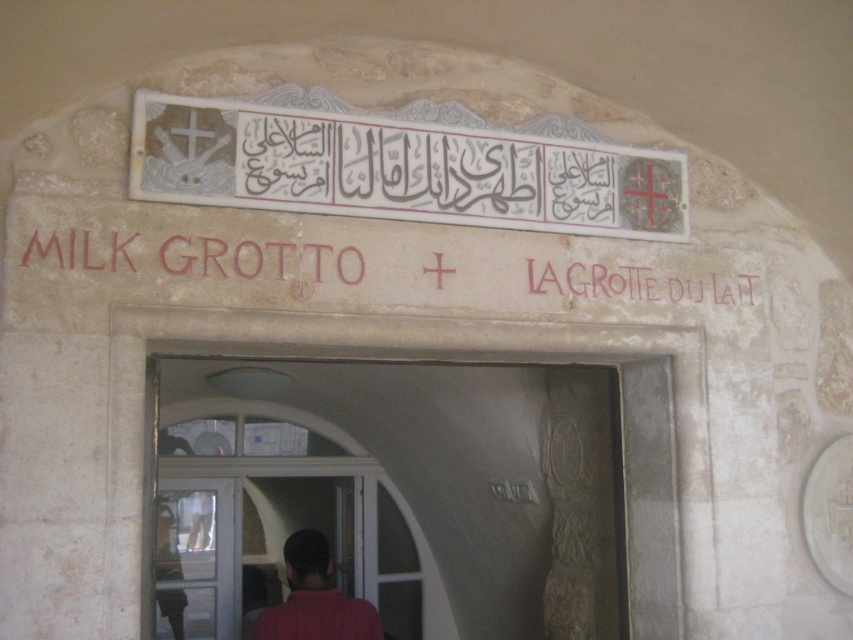
Which is more to the left, red stone sign at center or red matte shirt at center?

From the viewer's perspective, red matte shirt at center appears more on the left side.

Locate an element on the screen. Image resolution: width=853 pixels, height=640 pixels. red stone sign at center is located at coordinates (373, 266).

Who is shorter, white stone signboard at upper center or red matte shirt at center?

Standing shorter between the two is white stone signboard at upper center.

Find the location of a particular element. white stone signboard at upper center is located at coordinates (399, 166).

From the picture: Which is above, white stone signboard at upper center or transparent glass door at lower left?

Positioned higher is white stone signboard at upper center.

Does white stone signboard at upper center have a lesser width compared to transparent glass door at lower left?

No.

Locate an element on the screen. Image resolution: width=853 pixels, height=640 pixels. white stone signboard at upper center is located at coordinates (399, 166).